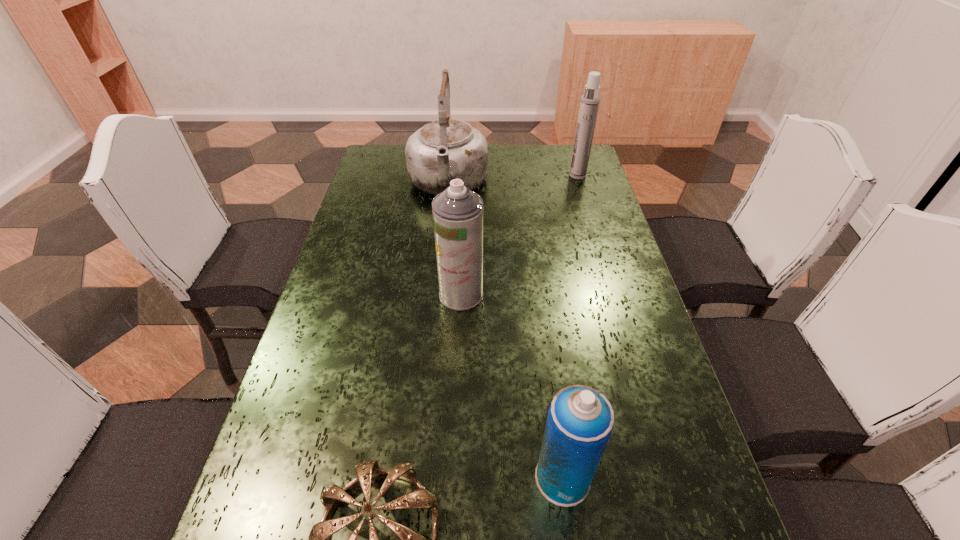
Where is `vacant space in between the rightmost aerosol can and the second aerosol can from right to left`? The image size is (960, 540). vacant space in between the rightmost aerosol can and the second aerosol can from right to left is located at coordinates (570, 327).

I want to click on free space between the rightmost object and the second aerosol can from left to right, so click(570, 327).

The height and width of the screenshot is (540, 960). I want to click on free space between the rightmost object and the kettle, so click(513, 180).

Where is `vacant point located between the fourth object from left to right and the kettle`? Image resolution: width=960 pixels, height=540 pixels. vacant point located between the fourth object from left to right and the kettle is located at coordinates (505, 332).

Identify the location of free point between the second shortest object and the rightmost aerosol can. (570, 327).

Identify the location of free space between the leftmost aerosol can and the farthest aerosol can. This screenshot has width=960, height=540. (519, 235).

Where is `vacant space in between the third farthest object and the rightmost object`? This screenshot has width=960, height=540. vacant space in between the third farthest object and the rightmost object is located at coordinates (519, 235).

The image size is (960, 540). What are the coordinates of `free space between the third nearest object and the second aerosol can from right to left` in the screenshot? It's located at (512, 386).

Identify which object is the fourth closest to the rightmost aerosol can. Please provide its 2D coordinates. Your answer should be formatted as a tuple, i.e. [(x, y)], where the tuple contains the x and y coordinates of a point satisfying the conditions above.

[(366, 471)]

Where is `the closest object to the third nearest object`? the closest object to the third nearest object is located at coordinates (447, 149).